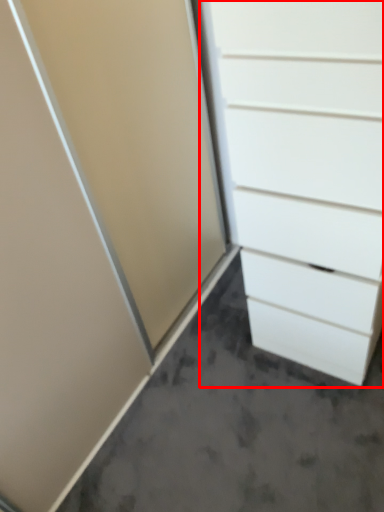
Question: From the image's perspective, what is the correct spatial positioning of chest of drawers (annotated by the red box) in reference to concrete?

Choices:
 (A) above
 (B) below

Answer: (A)